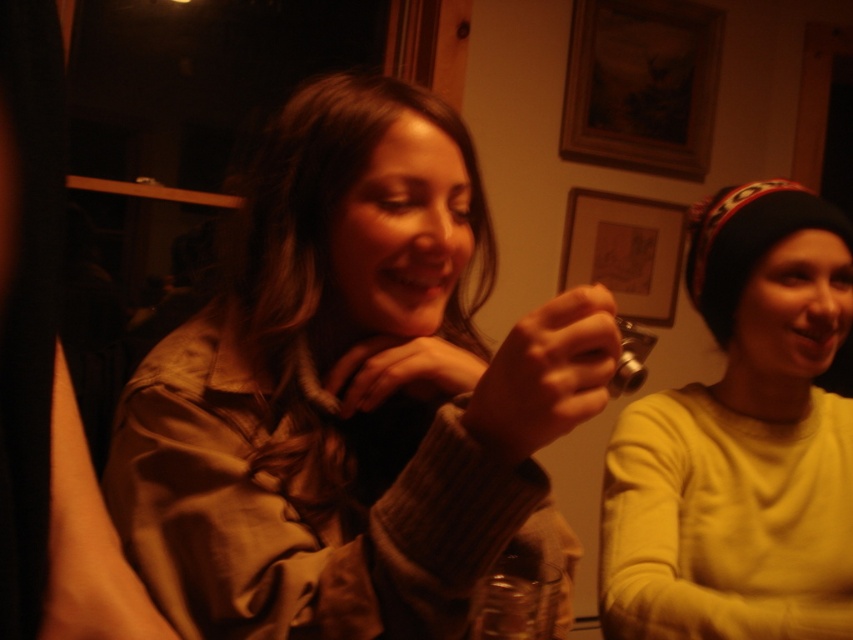
Question: In this image, where is matte brown jacket at center located relative to wooden picture frame at upper center?

Choices:
 (A) left
 (B) right

Answer: (A)

Question: Which of the following is the closest to the observer?

Choices:
 (A) (717, 627)
 (B) (473, 428)
 (C) (585, 243)

Answer: (B)

Question: Which of the following is the closest to the observer?

Choices:
 (A) (408, 522)
 (B) (585, 224)
 (C) (827, 237)
 (D) (590, 80)

Answer: (A)

Question: Can you confirm if matte brown jacket at center is bigger than matte yellow sweater at right?

Choices:
 (A) yes
 (B) no

Answer: (A)

Question: Which of the following is the closest to the observer?

Choices:
 (A) matte brown jacket at center
 (B) wooden frame at upper center
 (C) wooden picture frame at upper center
 (D) matte yellow sweater at right

Answer: (A)

Question: Does wooden frame at upper center have a larger size compared to wooden picture frame at upper center?

Choices:
 (A) no
 (B) yes

Answer: (B)